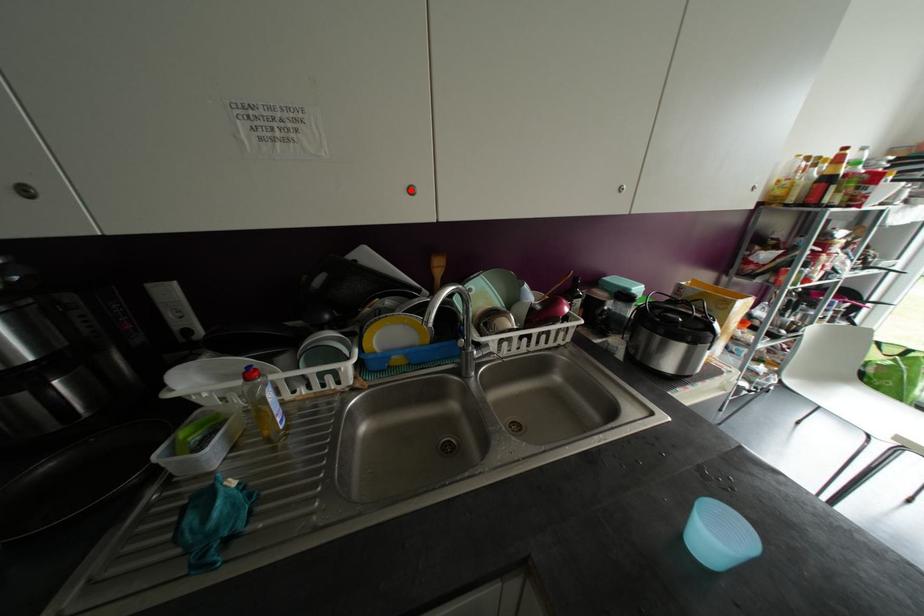
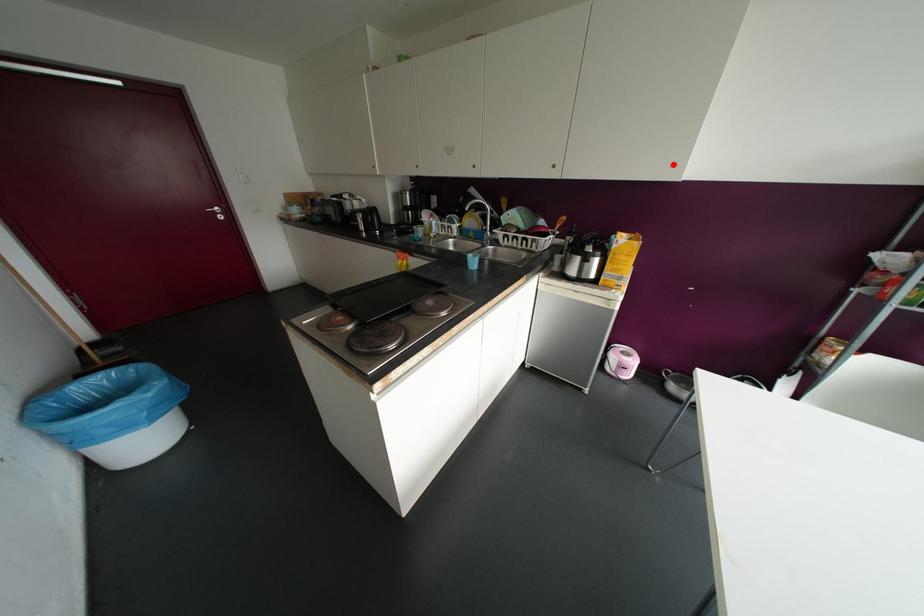
I am providing you with two images of the same scene from different viewpoints. A red point is marked on the first image and another point is marked on the second image. Is the red point in image1 aligned with the point shown in image2?

No